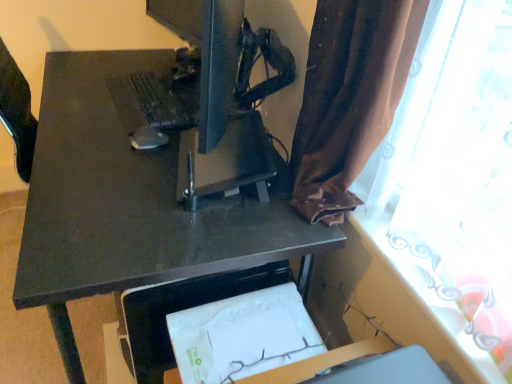
At what (x,y) coordinates should I click in order to perform the action: click on empty space that is ontop of matte black desk at center (from a real-world perspective). Please return your answer as a coordinate pair (x, y). Looking at the image, I should click on (138, 130).